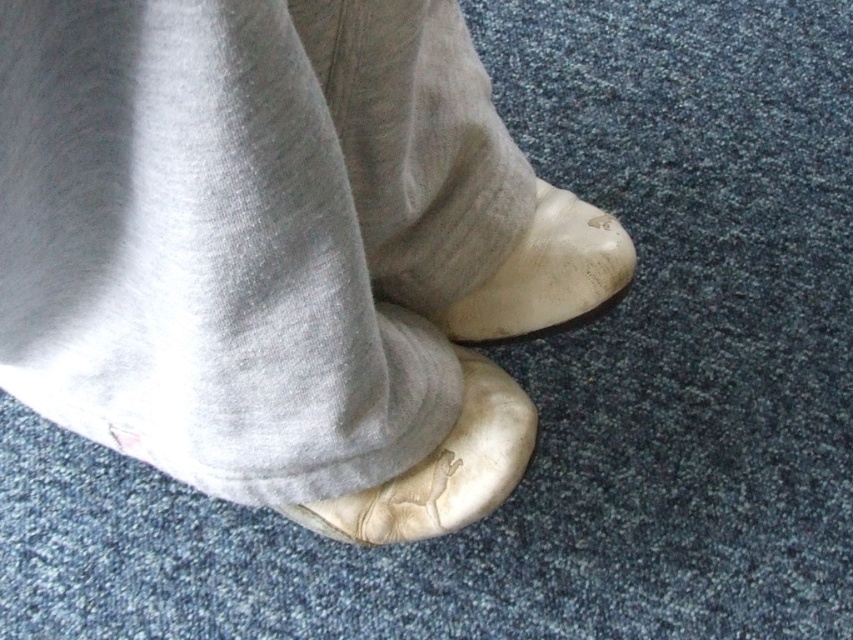
You are examining the image of a person wearing light gray sweatpants and beige shoes. You notice two points marked in the scene. Which point, point (438, 445) or point (627, 237), is closer to you?

Point (438, 445) is closer to the viewer than point (627, 237).

You are standing in a room with a blue carpet. You see a person wearing light gray sweatpants and beige shoes. There is a point marked at coordinates (x=440, y=468). What object is located at that point?

The point at coordinates (x=440, y=468) corresponds to the leather shoe at lower center.

You are trying to put on your shoes but notice both the leather slipper at center and the gray cotton sock at center. Which one is taller and needs to be worn first?

The leather slipper at center is taller than the gray cotton sock at center, so you should wear the gray cotton sock at center first before putting on the leather slipper at center.